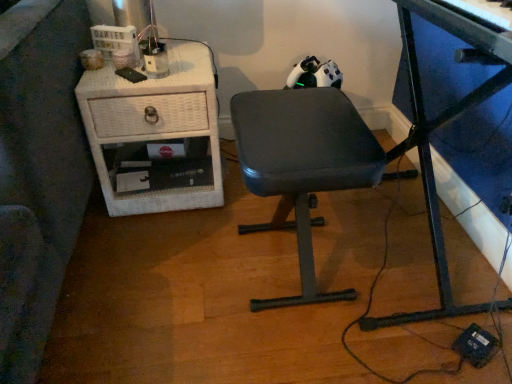
This screenshot has height=384, width=512. Find the location of `free location in front of white wicker nightstand at left`. free location in front of white wicker nightstand at left is located at coordinates (147, 252).